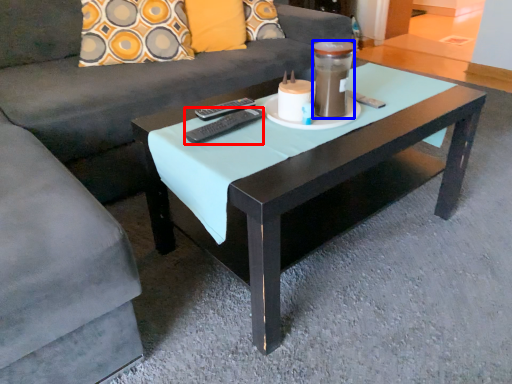
Question: Which point is closer to the camera, remote (highlighted by a red box) or beverage (highlighted by a blue box)?

Choices:
 (A) remote
 (B) beverage

Answer: (B)